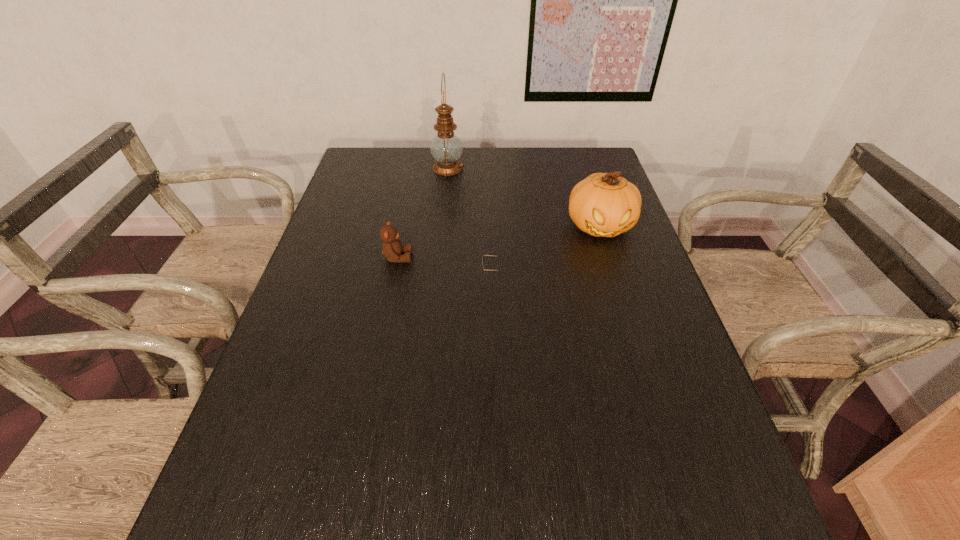
At what (x,y) coordinates should I click in order to perform the action: click on free point between the sunglasses and the teddy bear. Please return your answer as a coordinate pair (x, y). Looking at the image, I should click on (445, 267).

This screenshot has width=960, height=540. In order to click on empty location between the oil lamp and the pumpkin in this screenshot , I will do `click(524, 197)`.

Locate an element on the screen. free spot between the rightmost object and the leftmost object is located at coordinates (499, 242).

Identify the location of empty space between the shortest object and the oil lamp. The image size is (960, 540). (470, 222).

I want to click on unoccupied area between the tallest object and the second object from right to left, so click(x=470, y=222).

You are a GUI agent. You are given a task and a screenshot of the screen. Output one action in this format:
    pyautogui.click(x=<x>, y=<y>)
    Task: Click on the free spot between the leftmost object and the third nearest object
    This screenshot has width=960, height=540.
    Given the screenshot: What is the action you would take?
    pyautogui.click(x=499, y=242)

Find the location of a particular element. The image size is (960, 540). free spot between the shortest object and the third shortest object is located at coordinates (546, 251).

Identify the location of vacant space that is in between the second shortest object and the third object from left to right. This screenshot has width=960, height=540. (445, 267).

Find the location of `unoccupied area between the rightmost object and the oil lamp`. unoccupied area between the rightmost object and the oil lamp is located at coordinates (524, 197).

Select which object is the third closest to the teddy bear. Please provide its 2D coordinates. Your answer should be formatted as a tuple, i.e. [(x, y)], where the tuple contains the x and y coordinates of a point satisfying the conditions above.

[(604, 205)]